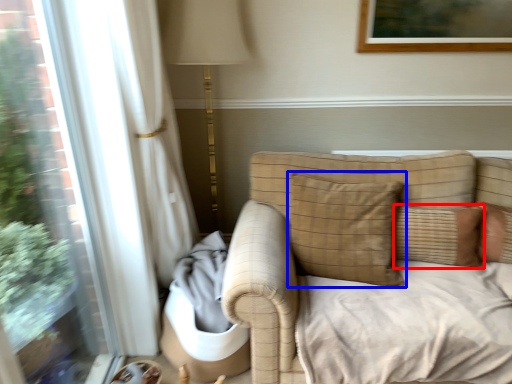
Question: Among these objects, which one is nearest to the camera, pillow (highlighted by a red box) or pillow (highlighted by a blue box)?

Choices:
 (A) pillow
 (B) pillow

Answer: (B)